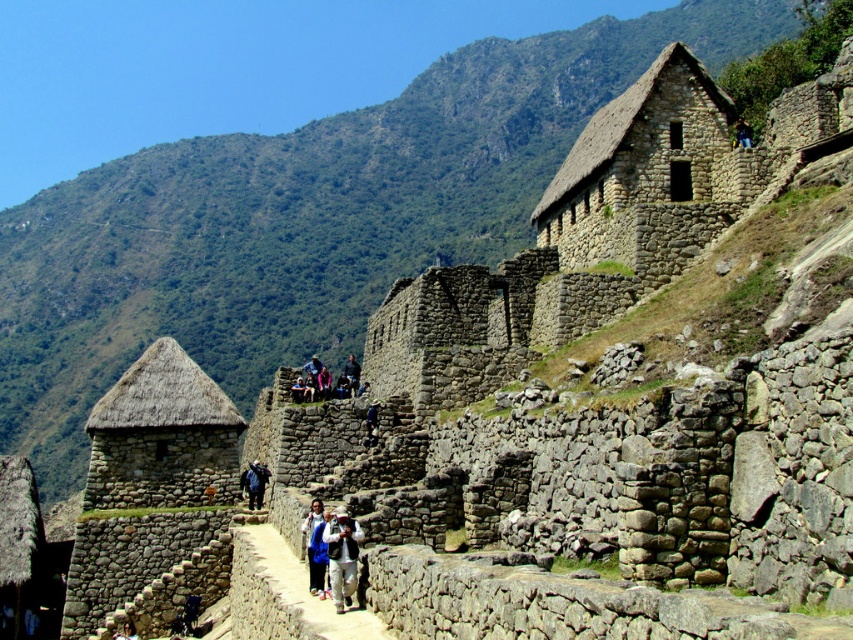
You are a tourist standing at the entrance of the ancient stone structure at Machu Picchu. You want to take a photo of the stone textured hut at upper right. Which direction should you face to capture it in your camera?

You should face towards the upper right direction to capture the stone textured hut at upper right in your camera since it is located at point (635, 160).